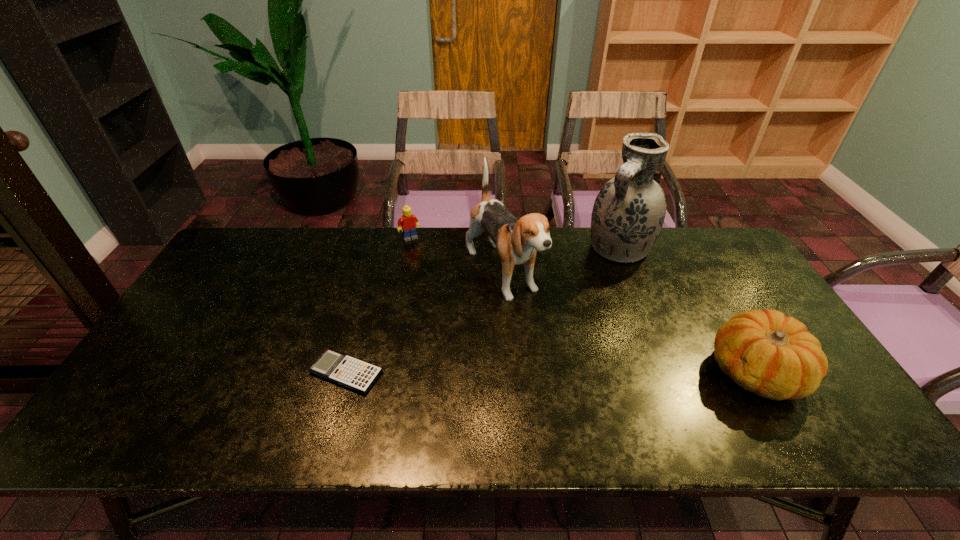
The image size is (960, 540). In order to click on vacant space situated at the face of the puppy in this screenshot , I will do point(544,339).

You are a GUI agent. You are given a task and a screenshot of the screen. Output one action in this format:
    pyautogui.click(x=<x>, y=<y>)
    Task: Click on the free space located on the front-facing side of the Lego
    
    Given the screenshot: What is the action you would take?
    pyautogui.click(x=460, y=319)

Where is `vacant space situated 0.280m on the front-facing side of the Lego`? The height and width of the screenshot is (540, 960). vacant space situated 0.280m on the front-facing side of the Lego is located at coordinates (444, 292).

Image resolution: width=960 pixels, height=540 pixels. Find the location of `free space located 0.240m on the front-facing side of the Lego`. free space located 0.240m on the front-facing side of the Lego is located at coordinates (440, 284).

What are the coordinates of `vacant region located 0.250m with the handle on the side of the vase` in the screenshot? It's located at (569, 309).

In order to click on blank area located 0.360m with the handle on the side of the vase in this screenshot , I will do `click(550, 333)`.

Identify the location of vacant area situated with the handle on the side of the vase. (569, 309).

This screenshot has width=960, height=540. I want to click on puppy situated at the far edge, so click(x=517, y=240).

At what (x,y) coordinates should I click in order to perform the action: click on Lego that is at the far edge. Please return your answer as a coordinate pair (x, y). This screenshot has width=960, height=540. Looking at the image, I should click on pos(408,223).

I want to click on vase at the far edge, so click(x=629, y=211).